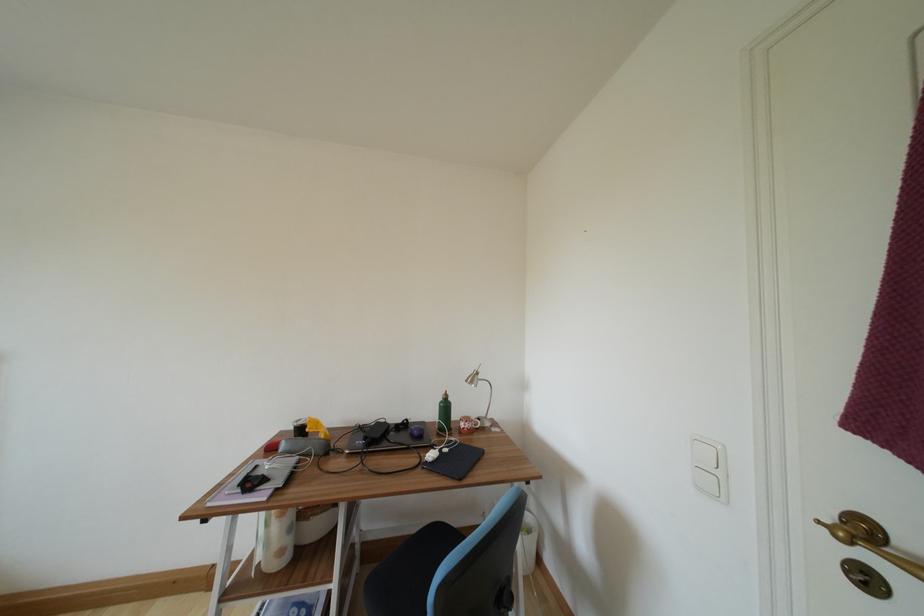
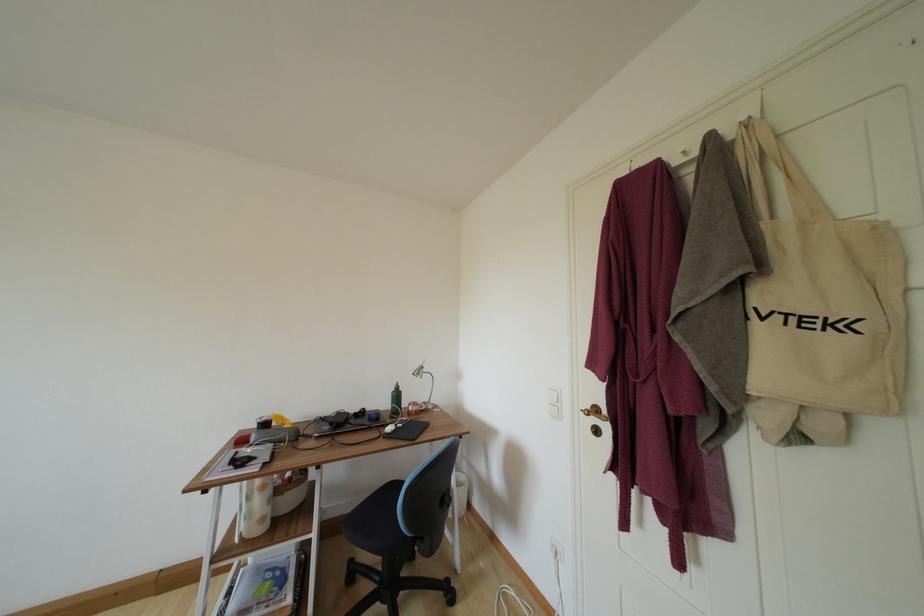
In the second image, find the point that corresponds to point 484,381 in the first image.

(430, 374)